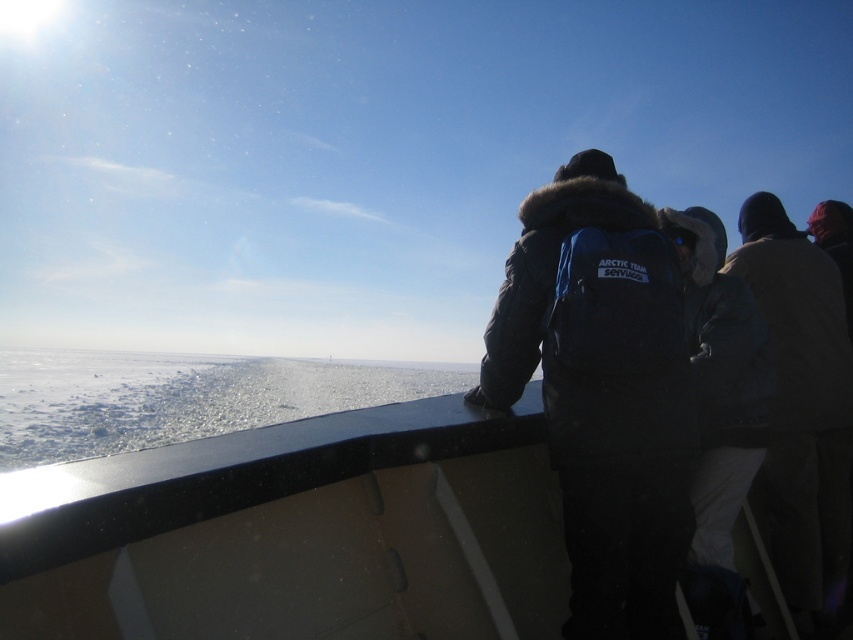
You are navigating a map where coordinates are given as fractions between 0 and 1. The smooth black boat at center is at position 0.833 on the x axis and 0.349 on the y axis. If you want to move directly north to reach the boat, should you increase or decrease your current y coordinate?

To move directly north towards the smooth black boat at center, you should increase your current y coordinate because the boat is located at y 0.349, and moving north requires increasing the y value.

You are standing on the boat deck and want to reach the dark blue puffy jacket at center. The coordinates you have are point (x=602, y=397). Is this point on the jacket?

Yes, the point (x=602, y=397) is on the dark blue puffy jacket at center, so you can use these coordinates to locate it.

You are planning to place a 1.5 meter wide box on the deck. The deck has limited space between the dark blue puffy jacket at center and the white ice at lower left. Based on their sizes, can the box fit between them?

The dark blue puffy jacket at center is narrower than the white ice at lower left. Since the box is 1.5 meters wide, the space between them may be sufficient if the total available width between the two objects meets or exceeds 1.5 meters. However, without exact measurements of the gap, it is uncertain. The jacket is narrower, but the ice is wider, so the space might accommodate the box depending on their arrangement.